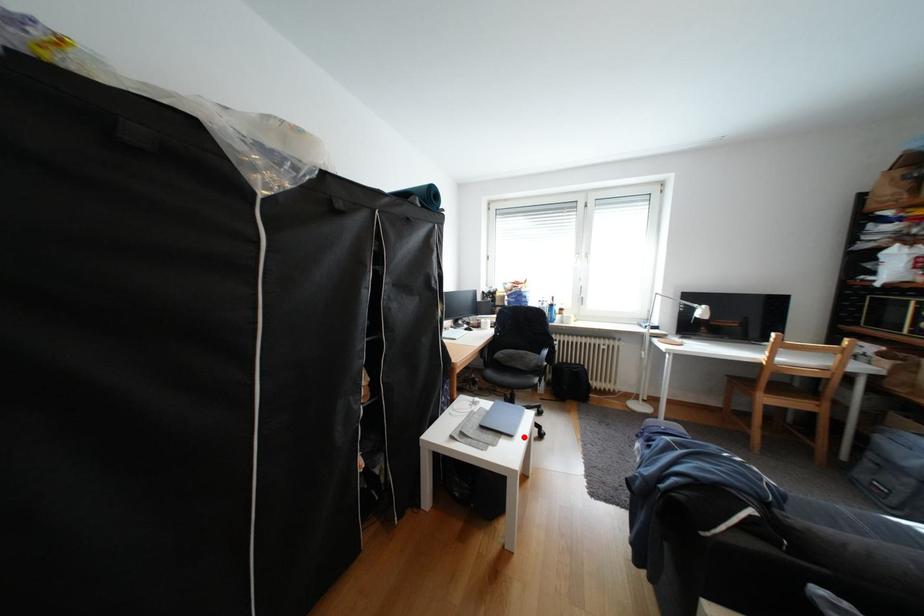
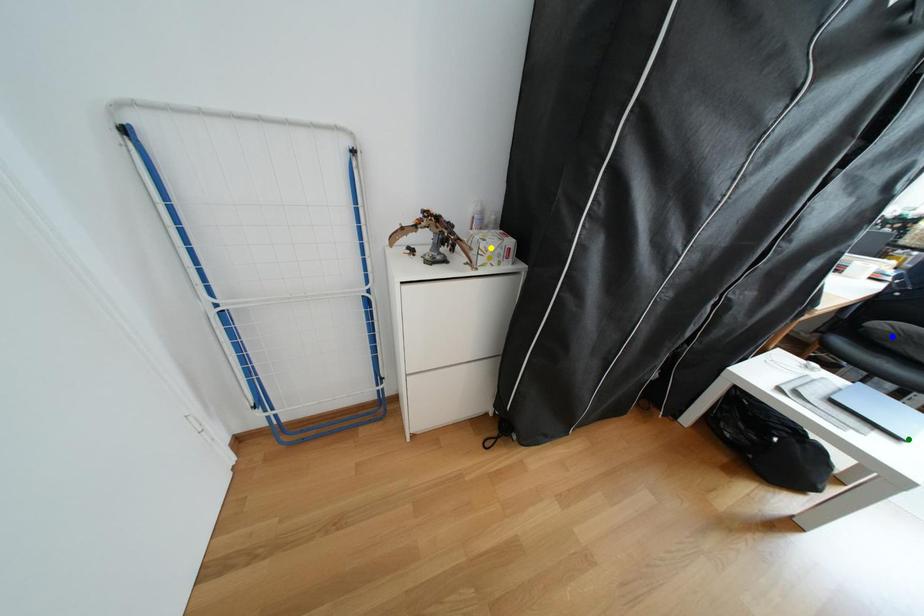
Question: I am providing you with two images of the same scene from different viewpoints. A red point is marked on the first image. You are given multiple points on the second image. Which spot in image 2 lines up with the point in image 1?

Choices:
 (A) blue point
 (B) green point
 (C) yellow point

Answer: (B)